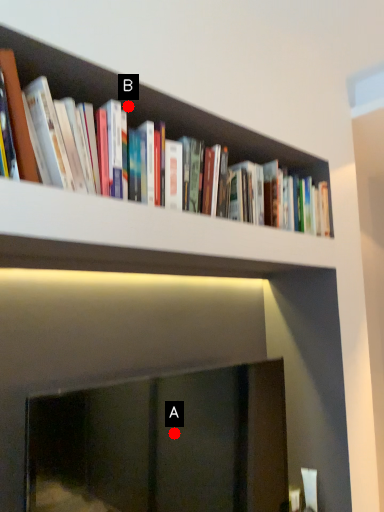
Question: Two points are circled on the image, labeled by A and B beside each circle. Among these points, which one is nearest to the camera?

Choices:
 (A) A is closer
 (B) B is closer

Answer: (A)